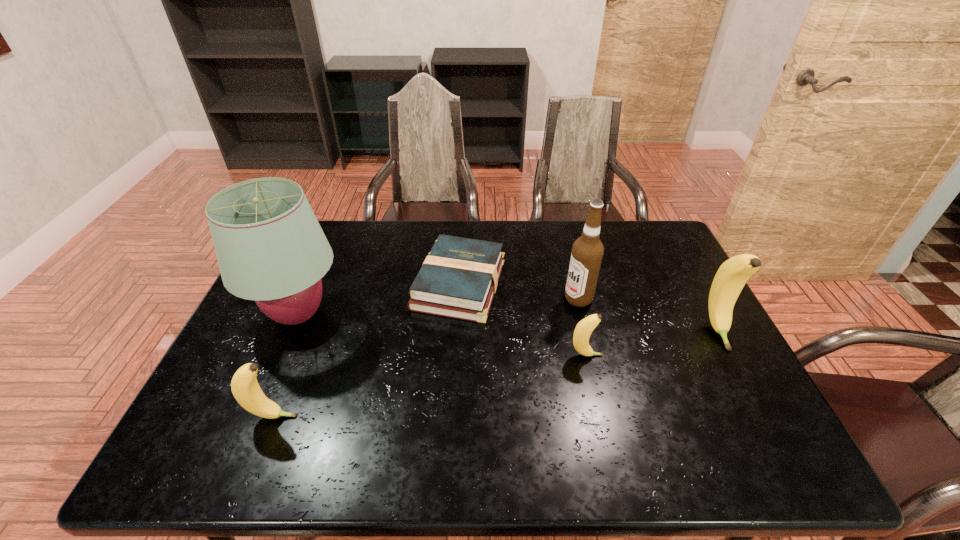
Identify the location of banana positioned at the left edge. (244, 385).

This screenshot has width=960, height=540. In order to click on lampshade present at the left edge in this screenshot , I will do `click(270, 248)`.

Where is `object located in the right edge section of the desktop`? The height and width of the screenshot is (540, 960). object located in the right edge section of the desktop is located at coordinates (732, 275).

Locate an element on the screen. The width and height of the screenshot is (960, 540). object that is positioned at the near left corner is located at coordinates (244, 385).

The image size is (960, 540). In the image, there is a desktop. Identify the location of vacant area at the far edge. (532, 255).

Locate an element on the screen. vacant space at the near edge of the desktop is located at coordinates click(559, 422).

Find the location of `vacant region at the far left corner`. vacant region at the far left corner is located at coordinates (324, 226).

The image size is (960, 540). I want to click on free space between the second tallest banana and the alcohol, so pos(426,357).

Locate an element on the screen. The width and height of the screenshot is (960, 540). free space between the rightmost object and the shortest banana is located at coordinates (652, 343).

Where is `blank region between the hardback book and the nearest object`? This screenshot has height=540, width=960. blank region between the hardback book and the nearest object is located at coordinates (367, 350).